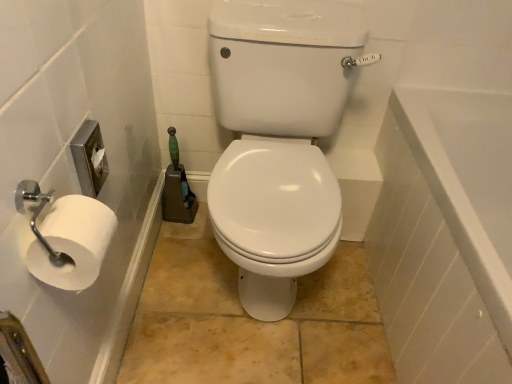
Question: Considering their positions, is white glossy bathtub at right located in front of or behind white matte toilet paper at left?

Choices:
 (A) front
 (B) behind

Answer: (B)

Question: From a real-world perspective, relative to white matte toilet paper at left, is white glossy bathtub at right vertically above or below?

Choices:
 (A) below
 (B) above

Answer: (A)

Question: Which object is positioned closest to the white matte toilet paper at left?

Choices:
 (A) white glossy bathtub at right
 (B) white glossy toilet seat at center

Answer: (B)

Question: Which of these objects is positioned farthest from the white glossy bathtub at right?

Choices:
 (A) white glossy toilet seat at center
 (B) white matte toilet paper at left

Answer: (B)